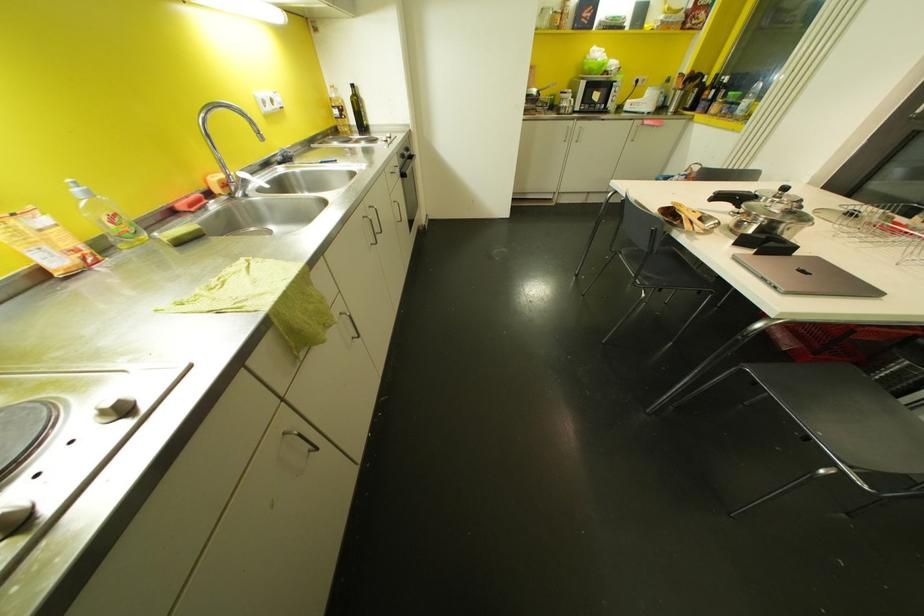
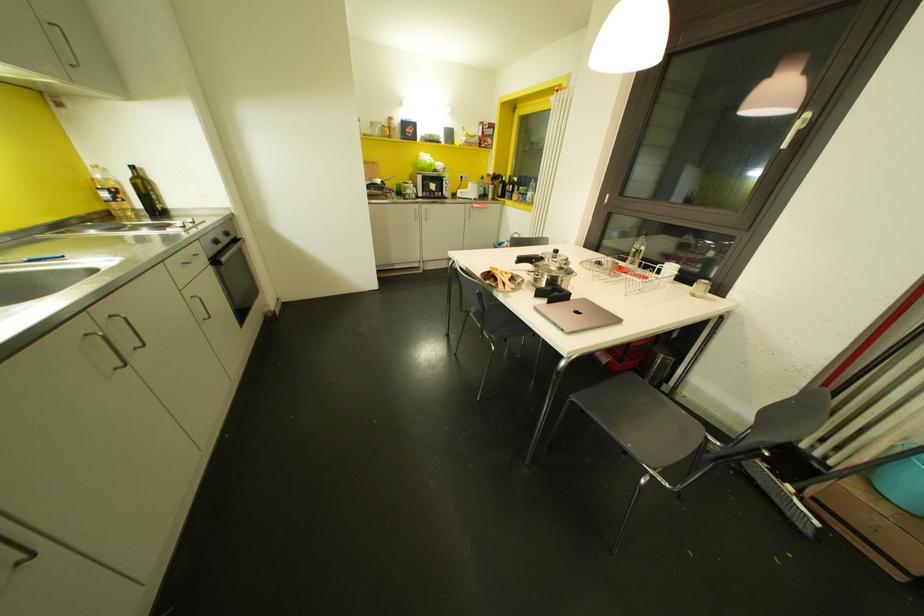
Question: The camera is either moving clockwise (left) or counter-clockwise (right) around the object. The first image is from the beginning of the video and the second image is from the end. Is the camera moving left or right when shooting the video?

Choices:
 (A) Left
 (B) Right

Answer: (A)